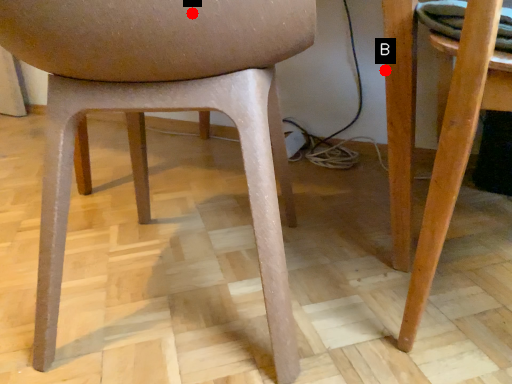
Question: Two points are circled on the image, labeled by A and B beside each circle. Which point appears farthest from the camera in this image?

Choices:
 (A) A is further
 (B) B is further

Answer: (B)